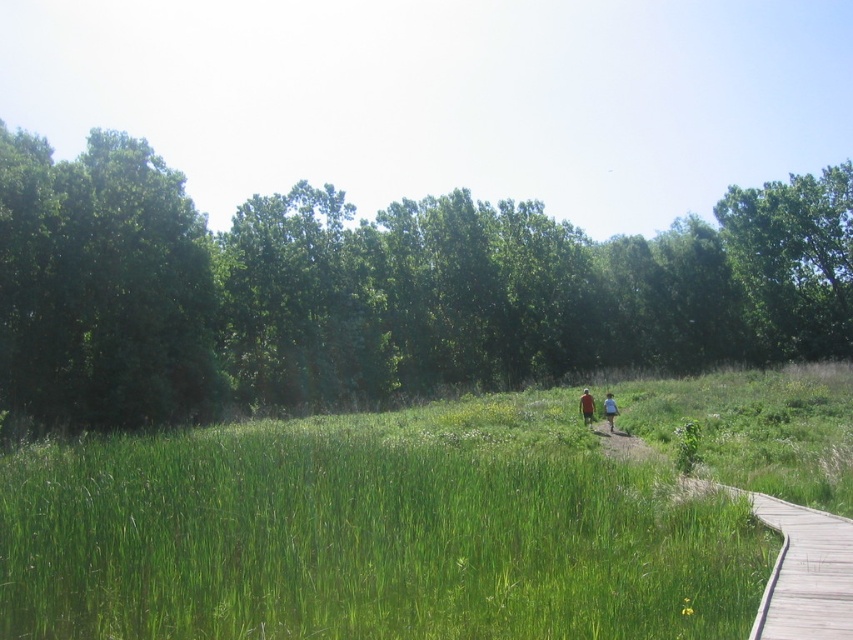
You are standing on the wooden boardwalk in the scene and want to walk towards the point at the lower right corner. Which of the two points, point (809, 192) or point (589, 420), is closer to your current position?

Point (809, 192) is closer to your current position because it is further to the viewer than point (589, 420).

You are standing on the wooden boardwalk at lower right and want to walk towards the red cotton shirt at center. Which direction should you move?

You should move to the right because the wooden boardwalk at lower right is to the left of the red cotton shirt at center, so moving right will bring you closer.